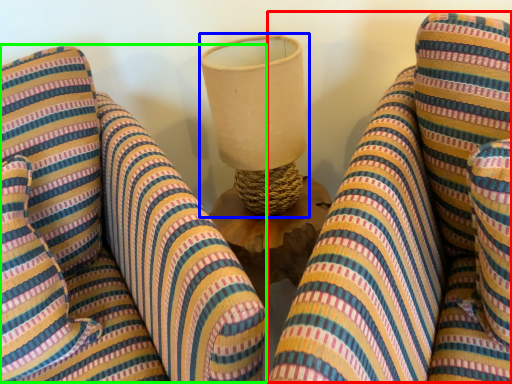
Question: Which object is positioned farthest from bean bag chair (highlighted by a red box)? Select from table lamp (highlighted by a blue box) and bean bag chair (highlighted by a green box).

Choices:
 (A) table lamp
 (B) bean bag chair

Answer: (B)